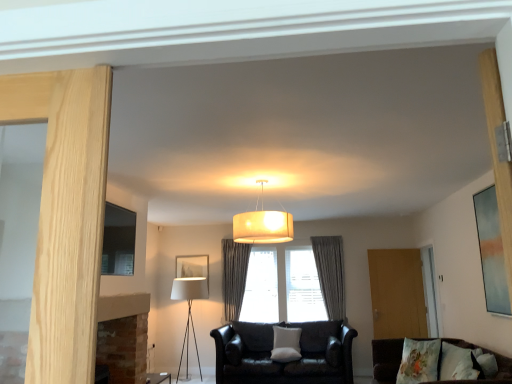
Where is `matte black picture frame at left, which is the 3th picture frame from right to left`? This screenshot has width=512, height=384. matte black picture frame at left, which is the 3th picture frame from right to left is located at coordinates (118, 241).

Identify the location of matte black leather couch at center, which ranks as the 1th studio couch in back-to-front order. click(288, 362).

How much space does matte black leather couch at center, which ranks as the 1th studio couch in back-to-front order, occupy horizontally?

matte black leather couch at center, which ranks as the 1th studio couch in back-to-front order, is 4.09 feet wide.

This screenshot has height=384, width=512. Identify the location of matte white lampshade at center. (262, 224).

Is white fabric picture frame at center, which ranks as the 3th picture frame in front-to-back order, far away from gray textured curtain at center, acting as the 2th curtain starting from the left?

Answer: Absolutely, white fabric picture frame at center, which ranks as the 3th picture frame in front-to-back order, is distant from gray textured curtain at center, acting as the 2th curtain starting from the left.

At what (x,y) coordinates should I click in order to perform the action: click on picture frame behind the gray textured curtain at center, the first curtain from the right. Please return your answer as a coordinate pair (x, y). This screenshot has height=384, width=512. Looking at the image, I should click on (191, 278).

Considering the sizes of objects white fabric picture frame at center, which is counted as the second picture frame, starting from the right, and gray textured curtain at center, acting as the 2th curtain starting from the left, in the image provided, who is thinner, white fabric picture frame at center, which is counted as the second picture frame, starting from the right, or gray textured curtain at center, acting as the 2th curtain starting from the left,?

Thinner between the two is white fabric picture frame at center, which is counted as the second picture frame, starting from the right.

Consider the image. Considering the relative positions of white fabric picture frame at center, which ranks as the 3th picture frame in front-to-back order, and gray textured curtain at center, the first curtain from the right, in the image provided, is white fabric picture frame at center, which ranks as the 3th picture frame in front-to-back order, to the left or to the right of gray textured curtain at center, the first curtain from the right,?

In the image, white fabric picture frame at center, which ranks as the 3th picture frame in front-to-back order, appears on the left side of gray textured curtain at center, the first curtain from the right.

From the wooden screen door at right, count 2nd picture frames forward and point to it. Please provide its 2D coordinates.

[(490, 252)]

In the scene shown: Would you say blue textured canvas at right, which is the 1th picture frame from front to back, is outside wooden screen door at right?

That's correct, blue textured canvas at right, which is the 1th picture frame from front to back, is outside of wooden screen door at right.

Could you tell me if blue textured canvas at right, marked as the 1th picture frame in a right-to-left arrangement, is facing wooden screen door at right?

No, blue textured canvas at right, marked as the 1th picture frame in a right-to-left arrangement, is not oriented towards wooden screen door at right.

From the image's perspective, which one is positioned higher, blue textured canvas at right, which appears as the 3th picture frame when viewed from the left, or wooden screen door at right?

blue textured canvas at right, which appears as the 3th picture frame when viewed from the left, from the image's perspective.

From the image's perspective, which is above, wooden screen door at right or gray textured curtain at center, the first curtain from the right?

From the image's view, gray textured curtain at center, the first curtain from the right, is above.

Considering the sizes of objects wooden screen door at right and gray textured curtain at center, the first curtain from the right, in the image provided, who is wider, wooden screen door at right or gray textured curtain at center, the first curtain from the right,?

gray textured curtain at center, the first curtain from the right, is wider.

Which of these two, wooden screen door at right or gray textured curtain at center, acting as the 2th curtain starting from the left, is smaller?

With smaller size is wooden screen door at right.

Is wooden screen door at right not within gray textured curtain at center, acting as the 2th curtain starting from the left?

wooden screen door at right lies outside gray textured curtain at center, acting as the 2th curtain starting from the left,'s area.

Is gray textured curtain at center, the first curtain from the right, facing towards white fabric picture frame at center, the 2th picture frame positioned from the left?

No.

Between point (322, 290) and point (190, 279), which one is positioned behind?

The point (190, 279) is behind.

Identify the location of curtain that is the 2nd one when counting rightward from the white fabric picture frame at center, the 2th picture frame positioned from the left. (331, 274).

Are gray textured curtain at center, the first curtain from the right, and white fabric picture frame at center, which ranks as the 3th picture frame in front-to-back order, located far from each other?

Absolutely, gray textured curtain at center, the first curtain from the right, is distant from white fabric picture frame at center, which ranks as the 3th picture frame in front-to-back order.

Between white fabric pillow at center, the first pillow when ordered from bottom to top, and gray fabric curtains at center, which one is positioned in front?

white fabric pillow at center, the first pillow when ordered from bottom to top.

The width and height of the screenshot is (512, 384). In order to click on window behind the white fabric pillow at center, the first pillow when ordered from bottom to top in this screenshot , I will do `click(305, 282)`.

Which object is positioned more to the right, white fabric pillow at center, the first pillow when ordered from back to front, or matte black picture frame at left, the first picture frame in the left-to-right sequence?

white fabric pillow at center, the first pillow when ordered from back to front.

Considering the points (285, 333) and (120, 213), which point is in front, point (285, 333) or point (120, 213)?

Point (120, 213)

Is white fabric pillow at center, the first pillow positioned from the left, facing away from matte black picture frame at left, arranged as the 2th picture frame when viewed from the back?

No, matte black picture frame at left, arranged as the 2th picture frame when viewed from the back, is not at the back of white fabric pillow at center, the first pillow positioned from the left.

Which of these two, white fabric pillow at center, which appears as the 3th pillow when viewed from the right, or matte black picture frame at left, the first picture frame in the left-to-right sequence, is wider?

With larger width is white fabric pillow at center, which appears as the 3th pillow when viewed from the right.

Is blue textured canvas at right, which appears as the 3th picture frame when viewed from the left, aimed at matte black picture frame at left, the first picture frame in the left-to-right sequence?

Yes, blue textured canvas at right, which appears as the 3th picture frame when viewed from the left, is aimed at matte black picture frame at left, the first picture frame in the left-to-right sequence.

Is blue textured canvas at right, marked as the 1th picture frame in a right-to-left arrangement, placed right next to matte black picture frame at left, arranged as the 2th picture frame when viewed from the back?

No.

Considering the relative positions of blue textured canvas at right, which is the 1th picture frame from front to back, and matte black picture frame at left, which is the 3th picture frame from right to left, in the image provided, is blue textured canvas at right, which is the 1th picture frame from front to back, in front of matte black picture frame at left, which is the 3th picture frame from right to left,?

Yes, blue textured canvas at right, which is the 1th picture frame from front to back, is in front of matte black picture frame at left, which is the 3th picture frame from right to left.

From the image's perspective, between blue textured canvas at right, which appears as the 3th picture frame when viewed from the left, and matte black picture frame at left, which is the second picture frame from front to back, who is located below?

blue textured canvas at right, which appears as the 3th picture frame when viewed from the left.

At what (x,y) coordinates should I click in order to perform the action: click on curtain that is the 2nd object located in front of the white fabric picture frame at center, the 2th picture frame positioned from the left. Please return your answer as a coordinate pair (x, y). Looking at the image, I should click on (331, 274).

Image resolution: width=512 pixels, height=384 pixels. In order to click on screen door located below the blue textured canvas at right, which appears as the 3th picture frame when viewed from the left (from the image's perspective) in this screenshot , I will do `click(397, 293)`.

Looking at the image, which one is located closer to wooden screen door at right, gray textured curtain at center, acting as the 2th curtain starting from the left, or blue textured canvas at right, which is the 1th picture frame from front to back?

The object closer to wooden screen door at right is gray textured curtain at center, acting as the 2th curtain starting from the left.

From the image, which object appears to be farther from gray fabric curtains at center, matte white lampshade at center or blue textured canvas at right, which is the 1th picture frame from front to back?

Based on the image, blue textured canvas at right, which is the 1th picture frame from front to back, appears to be further to gray fabric curtains at center.

Looking at the image, which one is located closer to gray fabric curtain at center, marked as the first curtain in a left-to-right arrangement, fluffy cotton pillow at lower right, the first pillow viewed from the right, or blue textured canvas at right, placed as the third picture frame when sorted from back to front?

fluffy cotton pillow at lower right, the first pillow viewed from the right, is positioned closer to the anchor gray fabric curtain at center, marked as the first curtain in a left-to-right arrangement.

Considering their positions, is gray textured curtain at center, the first curtain from the right, positioned further to velvet brown couch at lower right, the first studio couch viewed from the front, than white fabric picture frame at center, which ranks as the 3th picture frame in front-to-back order?

Among the two, white fabric picture frame at center, which ranks as the 3th picture frame in front-to-back order, is located further to velvet brown couch at lower right, the first studio couch viewed from the front.

Estimate the real-world distances between objects in this image. Which object is closer to matte white lampshade at center, white fabric picture frame at center, the 2th picture frame positioned from the left, or fluffy white pillow at lower right, arranged as the 3th pillow when viewed from the back?

Based on the image, fluffy white pillow at lower right, arranged as the 3th pillow when viewed from the back, appears to be nearer to matte white lampshade at center.

Looking at the image, which one is located closer to velvet brown couch at lower right, marked as the second studio couch in a back-to-front arrangement, matte black picture frame at left, which is the second picture frame from front to back, or matte black table at lower left?

matte black table at lower left is positioned closer to the anchor velvet brown couch at lower right, marked as the second studio couch in a back-to-front arrangement.

Considering their positions, is matte white fabric at left positioned closer to gray textured curtain at center, the first curtain from the right, than matte white lampshade at center?

matte white fabric at left is closer to gray textured curtain at center, the first curtain from the right.

Based on their spatial positions, is gray fabric curtain at center, marked as the first curtain in a left-to-right arrangement, or fluffy white pillow at lower right, arranged as the 2th pillow when viewed from the right, closer to matte white fabric at left?

Based on the image, gray fabric curtain at center, marked as the first curtain in a left-to-right arrangement, appears to be nearer to matte white fabric at left.

At what (x,y) coordinates should I click in order to perform the action: click on pillow between fluffy cotton pillow at lower right, the second pillow viewed from the top, and wooden screen door at right in the front-back direction. Please return your answer as a coordinate pair (x, y). The width and height of the screenshot is (512, 384). Looking at the image, I should click on (286, 344).

Find the location of a particular element. This screenshot has width=512, height=384. lamp located between velvet brown couch at lower right, the first studio couch viewed from the front, and white fabric pillow at center, the third pillow when ordered from front to back, in the depth direction is located at coordinates (262, 224).

Locate an element on the screen. This screenshot has width=512, height=384. lamp situated between matte black table at lower left and wooden screen door at right from left to right is located at coordinates (262, 224).

Image resolution: width=512 pixels, height=384 pixels. What are the coordinates of `table lamp located between matte black table at lower left and gray fabric curtain at center, marked as the first curtain in a left-to-right arrangement, in the depth direction` in the screenshot? It's located at (189, 311).